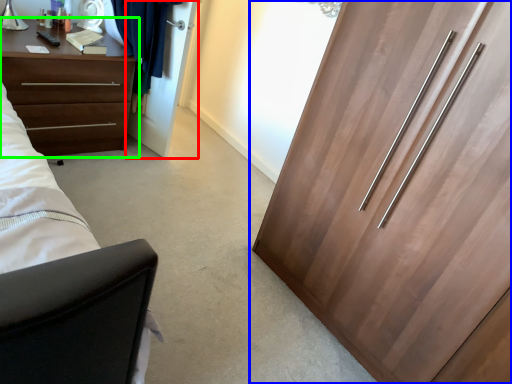
Question: Which is nearer to the door (highlighted by a red box)? cupboard (highlighted by a blue box) or chest of drawers (highlighted by a green box).

Choices:
 (A) cupboard
 (B) chest of drawers

Answer: (B)